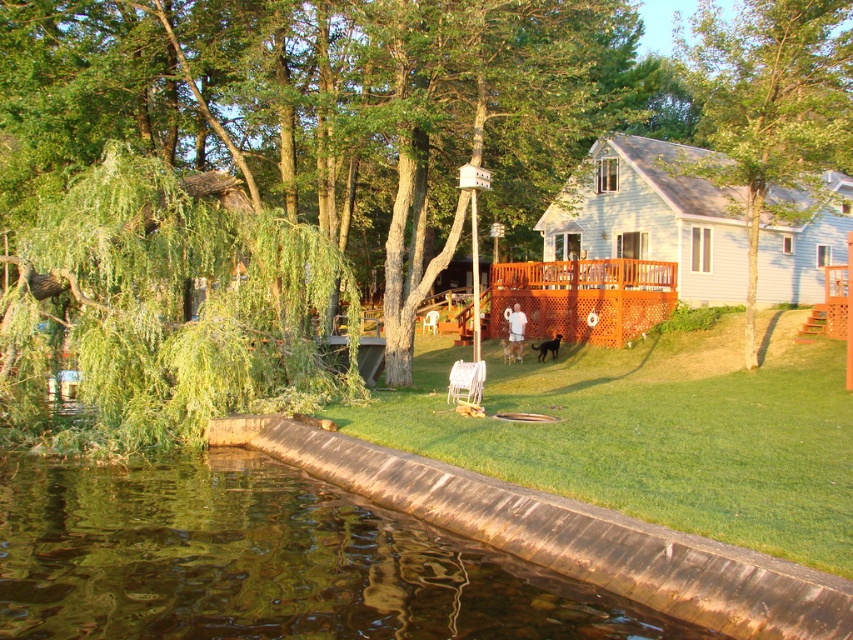
You are standing at the edge of the lake and want to place your white plastic chair at center so that it faces the sunset. Since the brown concrete water at lower left is to the left of the chair, which direction should you position the chair to face the sunset?

Since the brown concrete water at lower left is to the left of the white plastic chair at center, the chair should be positioned to face towards the right side to face the sunset, as the sunset is in the west and the left side of the chair is facing the east where the water is located.

You are planning to build a small wooden dock on the lakeside. You need to know the height difference between the brown concrete water at lower left and the green leafy tree at center. Which one is taller?

The green leafy tree at center is taller than the brown concrete water at lower left according to the description.